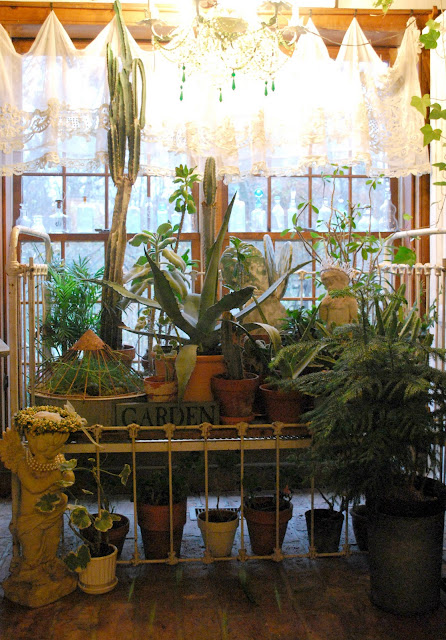
You are a GUI agent. You are given a task and a screenshot of the screen. Output one action in this format:
    pyautogui.click(x=<x>, y=<y>)
    Task: Click on the light orange pot
    The image size is (446, 640).
    Given the screenshot: What is the action you would take?
    pyautogui.click(x=199, y=377)